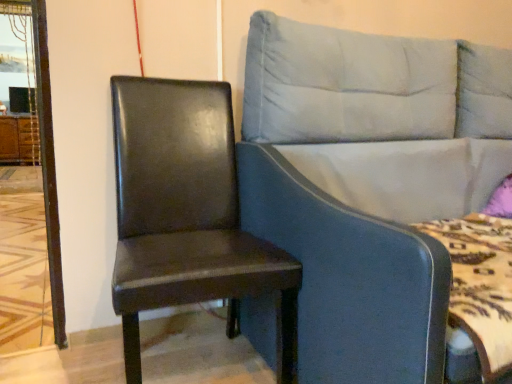
Question: Would you consider matte black chair at left to be distant from brown wood dresser at left?

Choices:
 (A) yes
 (B) no

Answer: (A)

Question: Is matte black chair at left shorter than brown wood dresser at left?

Choices:
 (A) yes
 (B) no

Answer: (B)

Question: Considering the relative positions of matte black chair at left and brown wood dresser at left in the image provided, is matte black chair at left to the right of brown wood dresser at left from the viewer's perspective?

Choices:
 (A) yes
 (B) no

Answer: (A)

Question: From the image's perspective, is matte black chair at left located beneath brown wood dresser at left?

Choices:
 (A) no
 (B) yes

Answer: (B)

Question: Is matte black chair at left positioned in front of brown wood dresser at left?

Choices:
 (A) yes
 (B) no

Answer: (A)

Question: Can you confirm if matte black chair at left is taller than brown wood dresser at left?

Choices:
 (A) yes
 (B) no

Answer: (A)

Question: Can you confirm if brown wood dresser at left is smaller than matte black chair at left?

Choices:
 (A) yes
 (B) no

Answer: (A)

Question: Considering the relative sizes of brown wood dresser at left and matte black chair at left in the image provided, is brown wood dresser at left taller than matte black chair at left?

Choices:
 (A) no
 (B) yes

Answer: (A)

Question: Is there a large distance between brown wood dresser at left and matte black chair at left?

Choices:
 (A) no
 (B) yes

Answer: (B)

Question: Is brown wood dresser at left next to matte black chair at left and touching it?

Choices:
 (A) yes
 (B) no

Answer: (B)

Question: Can you confirm if brown wood dresser at left is bigger than matte black chair at left?

Choices:
 (A) no
 (B) yes

Answer: (A)

Question: Can you confirm if brown wood dresser at left is positioned to the left of matte black chair at left?

Choices:
 (A) yes
 (B) no

Answer: (A)

Question: Can you confirm if brown wood dresser at left is bigger than light blue fabric studio couch at center?

Choices:
 (A) no
 (B) yes

Answer: (A)